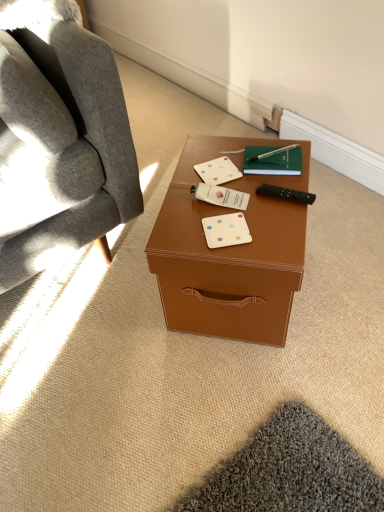
This screenshot has width=384, height=512. Identify the location of vacant region to the left of green matte notebook at center. (204, 162).